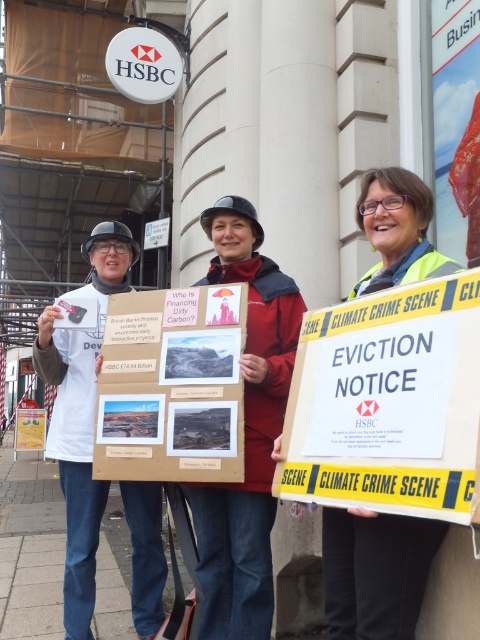
Consider the image. You are a photographer trying to capture the protest scene. You notice the red fabric coat at center and the white paperboard at left. Which object should you focus on first if you want to take a clear photo of the one closer to you?

The red fabric coat at center is closer to the viewer than the white paperboard at left, so you should focus on the red fabric coat at center first to ensure clarity.

You are a city planner analyzing the layout of this protest scene. Given the yellow reflective vest at center and the wooden board at center, which object takes up more space in the scene?

The wooden board at center takes up more space in the scene because the yellow reflective vest at center occupies less space than the wooden board at center.